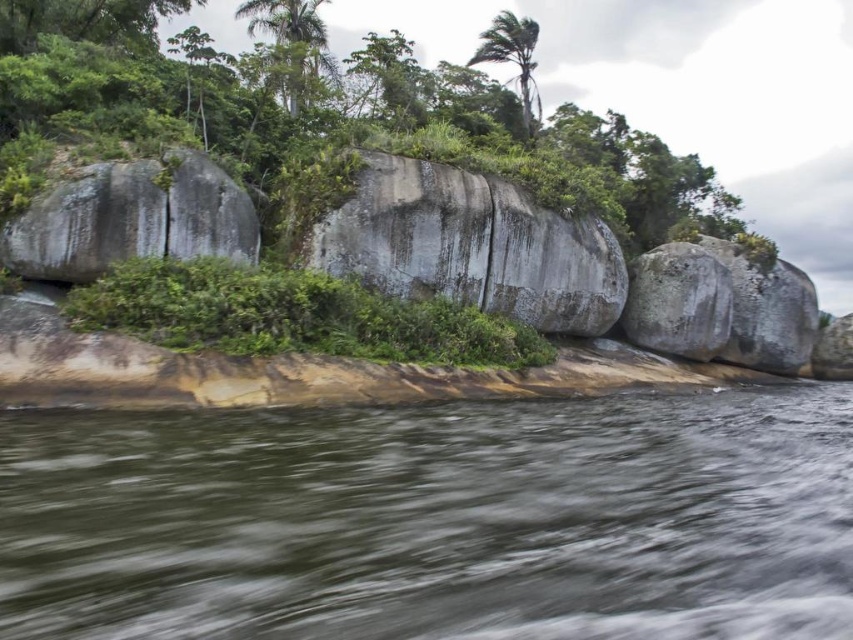
Question: Which of these objects is positioned closest to the brown water at lower center?

Choices:
 (A) green leafy tree at center
 (B) green leafy shrubs at center

Answer: (B)

Question: Does gray textured rock at center have a greater width compared to green leafy shrubs at center?

Choices:
 (A) no
 (B) yes

Answer: (A)

Question: Is green leafy tree at center to the left of gray rough boulder at left from the viewer's perspective?

Choices:
 (A) yes
 (B) no

Answer: (B)

Question: Which object appears farthest from the camera in this image?

Choices:
 (A) gray rough boulder at left
 (B) gray textured rock at center

Answer: (B)

Question: Can you confirm if green leafy tree at center is positioned to the right of green leafy tree at upper left?

Choices:
 (A) yes
 (B) no

Answer: (A)

Question: Which point is farther to the camera?

Choices:
 (A) (180, 588)
 (B) (264, 0)
 (C) (125, 256)
 (D) (310, 285)

Answer: (B)